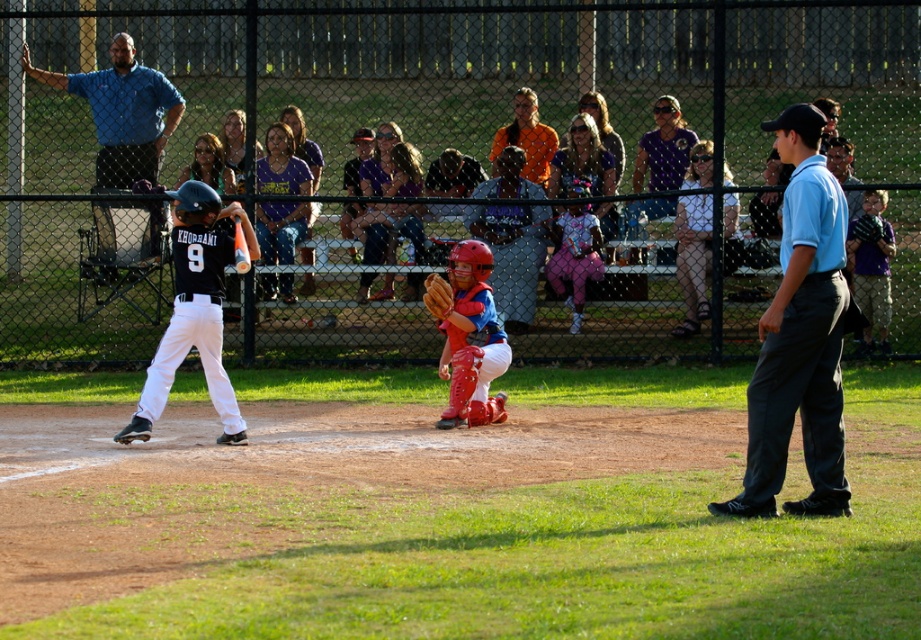
Is the position of light blue shirt at right less distant than that of brown leather glove at center?

Yes, it is in front of brown leather glove at center.

Can you confirm if light blue shirt at right is taller than brown leather glove at center?

Yes.

Is point (800, 205) less distant than point (450, 308)?

That is True.

Image resolution: width=921 pixels, height=640 pixels. I want to click on light blue shirt at right, so click(800, 337).

Between striped cotton shirt at right and orange matte baseball at center, which one has less height?

orange matte baseball at center

Can you confirm if striped cotton shirt at right is smaller than orange matte baseball at center?

No, striped cotton shirt at right is not smaller than orange matte baseball at center.

Where is `striped cotton shirt at right`? The image size is (921, 640). striped cotton shirt at right is located at coordinates (871, 269).

From the picture: Between patterned fabric dress at center and orange matte baseball at center, which one appears on the left side from the viewer's perspective?

From the viewer's perspective, orange matte baseball at center appears more on the left side.

Does patterned fabric dress at center appear under orange matte baseball at center?

Actually, patterned fabric dress at center is above orange matte baseball at center.

Who is more distant from viewer, [577,252] or [249,268]?

Point [577,252]

At what (x,y) coordinates should I click in order to perform the action: click on patterned fabric dress at center. Please return your answer as a coordinate pair (x, y). Looking at the image, I should click on (574, 257).